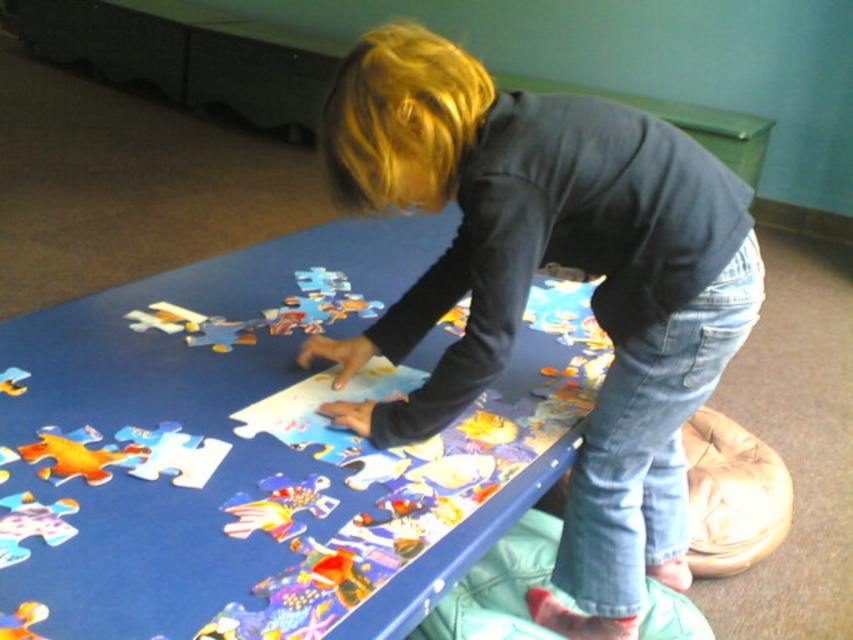
Does blue cardboard puzzle board at center have a lesser width compared to matte black shirt at center?

No.

Where is `blue cardboard puzzle board at center`? blue cardboard puzzle board at center is located at coordinates (259, 451).